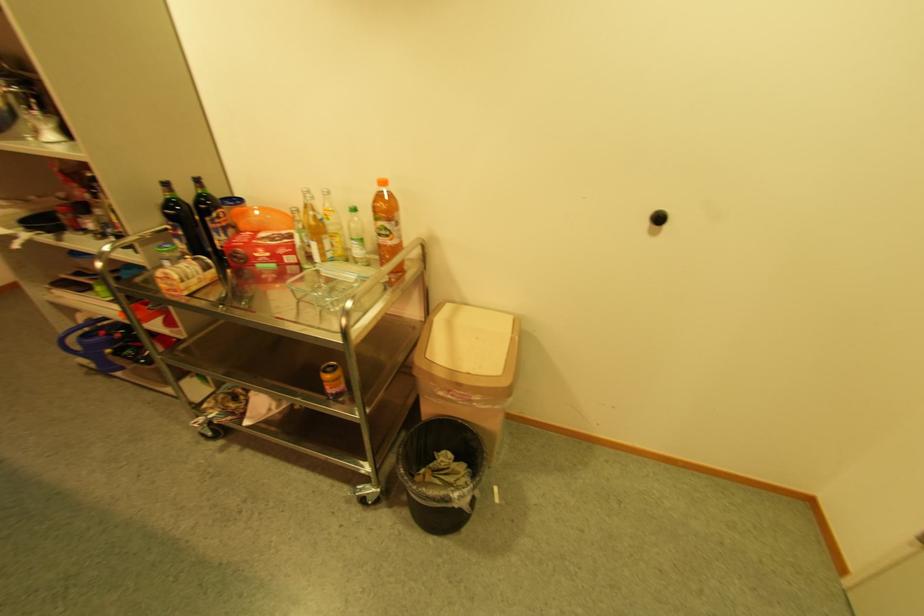
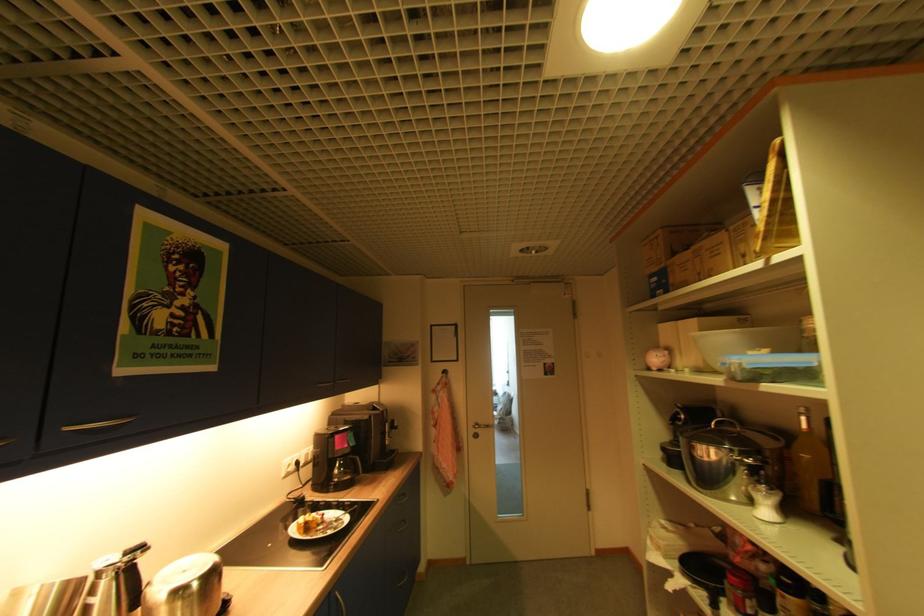
Where in the second image is the point corresponding to (57,137) from the first image?

(772, 513)